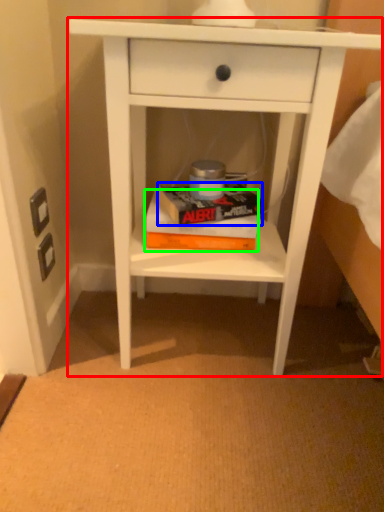
Question: Considering the real-world distances, which object is farthest from nightstand (highlighted by a red box)? paperback book (highlighted by a blue box) or paperback book (highlighted by a green box)?

Choices:
 (A) paperback book
 (B) paperback book

Answer: (A)